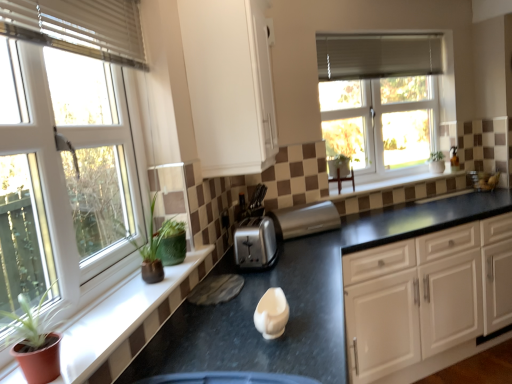
Question: From a real-world perspective, is white plastic window at left, which appears as the first window when viewed from the front, positioned under matte green plant at left based on gravity?

Choices:
 (A) yes
 (B) no

Answer: (B)

Question: Is white plastic window at left, which appears as the first window when viewed from the left, not within matte green plant at left?

Choices:
 (A) yes
 (B) no

Answer: (A)

Question: Considering the relative sizes of white plastic window at left, the second window from the right, and matte green plant at left in the image provided, is white plastic window at left, the second window from the right, wider than matte green plant at left?

Choices:
 (A) no
 (B) yes

Answer: (A)

Question: Can you confirm if white plastic window at left, which is counted as the second window, starting from the back, is positioned to the left of matte green plant at left?

Choices:
 (A) yes
 (B) no

Answer: (A)

Question: Considering the relative sizes of white plastic window at left, the second window from the right, and matte green plant at left in the image provided, is white plastic window at left, the second window from the right, taller than matte green plant at left?

Choices:
 (A) yes
 (B) no

Answer: (A)

Question: From a real-world perspective, is white matte cabinet at upper center, positioned as the 2th cabinetry in bottom-to-top order, above or below satin silver toaster at center, arranged as the first appliance when viewed from the right?

Choices:
 (A) below
 (B) above

Answer: (B)

Question: In terms of width, does white matte cabinet at upper center, arranged as the second cabinetry when viewed from the right, look wider or thinner when compared to satin silver toaster at center, placed as the 2th appliance when sorted from front to back?

Choices:
 (A) wide
 (B) thin

Answer: (A)

Question: Considering the positions of white matte cabinet at upper center, arranged as the second cabinetry when viewed from the right, and satin silver toaster at center, placed as the 2th appliance when sorted from left to right, in the image, is white matte cabinet at upper center, arranged as the second cabinetry when viewed from the right, taller or shorter than satin silver toaster at center, placed as the 2th appliance when sorted from left to right,?

Choices:
 (A) tall
 (B) short

Answer: (A)

Question: Considering the positions of point (188, 41) and point (288, 218), is point (188, 41) closer or farther from the camera than point (288, 218)?

Choices:
 (A) farther
 (B) closer

Answer: (B)

Question: Is white matte cabinet at upper center, arranged as the second cabinetry when viewed from the right, taller or shorter than white fabric blind at upper right, the first blind when ordered from right to left?

Choices:
 (A) tall
 (B) short

Answer: (A)

Question: From the image's perspective, is white matte cabinet at upper center, positioned as the 2th cabinetry in bottom-to-top order, positioned above or below white fabric blind at upper right, which ranks as the second blind in left-to-right order?

Choices:
 (A) below
 (B) above

Answer: (A)

Question: In the image, is white matte cabinet at upper center, positioned as the 2th cabinetry in bottom-to-top order, on the left side or the right side of white fabric blind at upper right, the first blind when ordered from right to left?

Choices:
 (A) right
 (B) left

Answer: (B)

Question: Is white matte cabinet at upper center, positioned as the 2th cabinetry in bottom-to-top order, spatially inside white fabric blind at upper right, arranged as the first blind when viewed from the top, or outside of it?

Choices:
 (A) outside
 (B) inside

Answer: (A)

Question: Is black granite countertop at center wider or thinner than green matte plant at left?

Choices:
 (A) wide
 (B) thin

Answer: (A)

Question: In terms of size, does black granite countertop at center appear bigger or smaller than green matte plant at left?

Choices:
 (A) big
 (B) small

Answer: (A)